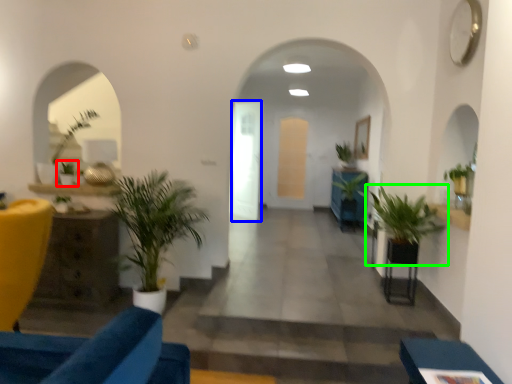
Question: Which is farther away from houseplant (highlighted by a red box)? glass door (highlighted by a blue box) or houseplant (highlighted by a green box)?

Choices:
 (A) glass door
 (B) houseplant

Answer: (A)